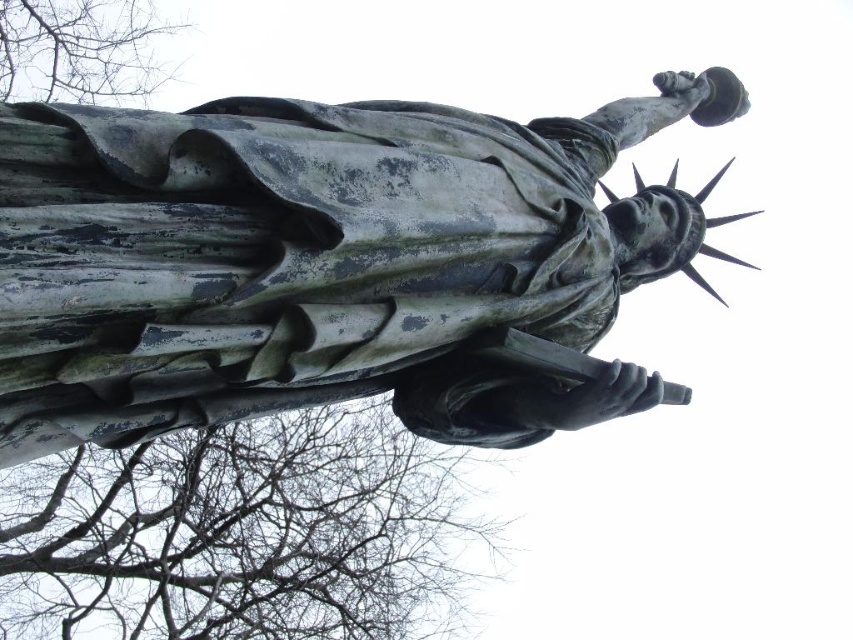
Does green patina statue at center come behind bare branches at upper left?

No, green patina statue at center is in front of bare branches at upper left.

Can you confirm if green patina statue at center is positioned to the left of bare branches at upper left?

In fact, green patina statue at center is to the right of bare branches at upper left.

Identify the location of green patina statue at center. The height and width of the screenshot is (640, 853). (326, 260).

Who is taller, green patina statue at center or bare branches at upper center?

With more height is bare branches at upper center.

From the picture: Who is more forward, (585, 204) or (183, 477)?

Positioned in front is point (585, 204).

I want to click on green patina statue at center, so click(x=326, y=260).

Which of these two, bare branches at upper center or bare branches at upper left, stands taller?

bare branches at upper center is taller.

Is bare branches at upper center wider than bare branches at upper left?

Yes.

Between point (178, 464) and point (47, 12), which one is positioned behind?

The point (178, 464) is behind.

I want to click on bare branches at upper center, so click(x=241, y=534).